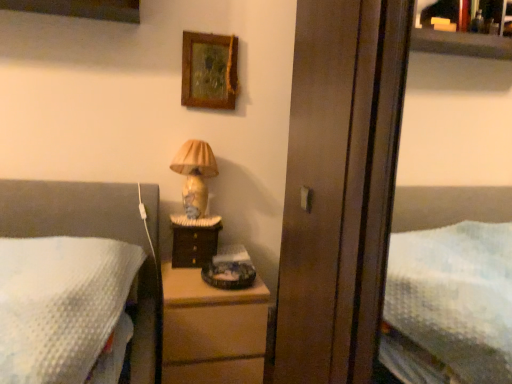
Locate an element on the screen. The height and width of the screenshot is (384, 512). free location above wooden chest of drawers at center (from a real-world perspective) is located at coordinates (196, 271).